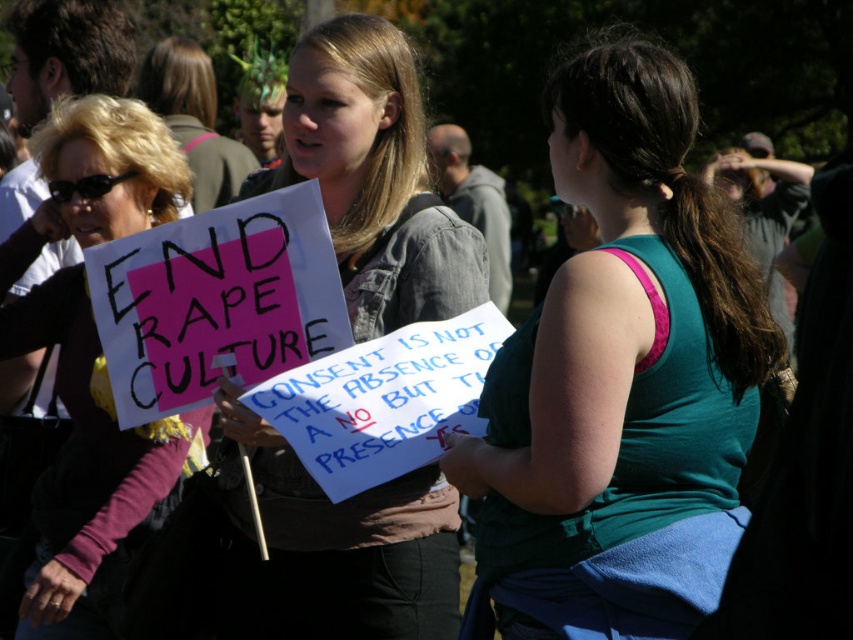
Question: Does denim jacket at center appear on the right side of matte black sign at left?

Choices:
 (A) yes
 (B) no

Answer: (A)

Question: Estimate the real-world distances between objects in this image. Which object is closer to the matte black sign at left?

Choices:
 (A) blonde hair at upper left
 (B) teal fabric tank top at center
 (C) denim jacket at center

Answer: (C)

Question: Which is farther from the denim jacket at center?

Choices:
 (A) teal fabric tank top at center
 (B) blonde hair at upper left

Answer: (B)

Question: Which point is farther from the camera taking this photo?

Choices:
 (A) (221, 196)
 (B) (428, 540)
 (C) (752, 312)

Answer: (A)

Question: Does teal fabric tank top at center have a greater width compared to denim jacket at center?

Choices:
 (A) yes
 (B) no

Answer: (A)

Question: Can you confirm if denim jacket at center is thinner than blonde hair at upper left?

Choices:
 (A) yes
 (B) no

Answer: (A)